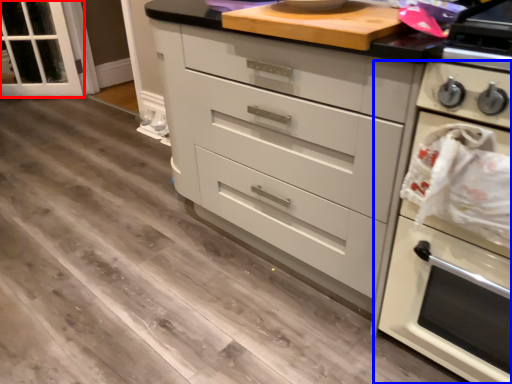
Question: Which of the following is the closest to the observer, glass door (highlighted by a red box) or home appliance (highlighted by a blue box)?

Choices:
 (A) glass door
 (B) home appliance

Answer: (B)